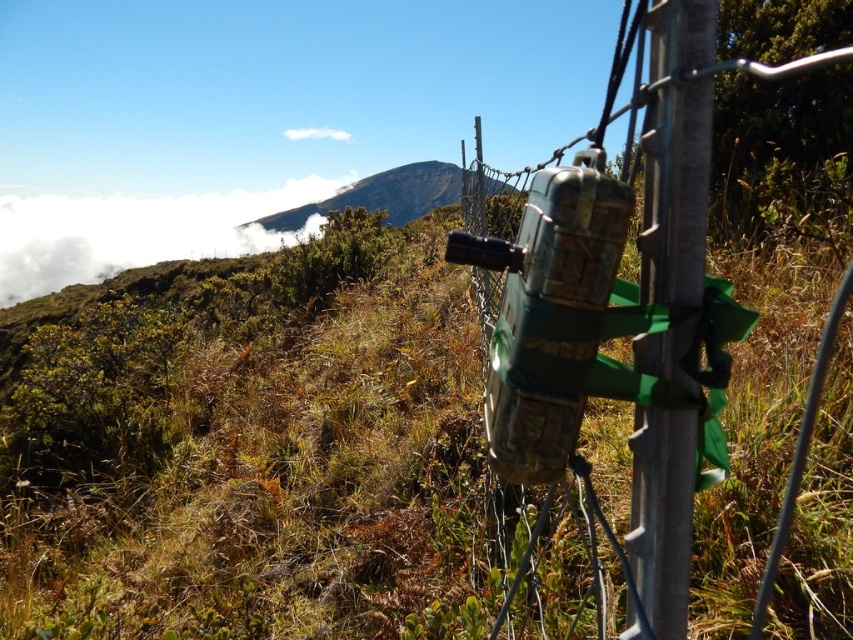
Is point (689, 120) closer to camera compared to point (51, 285)?

Yes, it is in front of point (51, 285).

Is the position of metallic chain-link fence at center-right more distant than that of white fluffy cloud at upper left?

That is False.

Does point (688, 522) come in front of point (32, 208)?

Yes, point (688, 522) is closer to viewer.

In order to click on metallic chain-link fence at center-right in this screenshot , I will do `click(621, 307)`.

Does metallic pole at right have a lesser height compared to white fluffy cloud at upper left?

Yes, metallic pole at right is shorter than white fluffy cloud at upper left.

Which is more to the right, metallic pole at right or white fluffy cloud at upper left?

Positioned to the right is metallic pole at right.

Find the location of a particular element. metallic pole at right is located at coordinates (671, 307).

Who is more forward, (727, 472) or (683, 132)?

Point (683, 132) is more forward.

Does metallic chain-link fence at center-right have a lesser height compared to metallic pole at right?

In fact, metallic chain-link fence at center-right may be taller than metallic pole at right.

Is point (683, 33) farther from camera compared to point (670, 248)?

No, it is not.

I want to click on metallic chain-link fence at center-right, so click(621, 307).